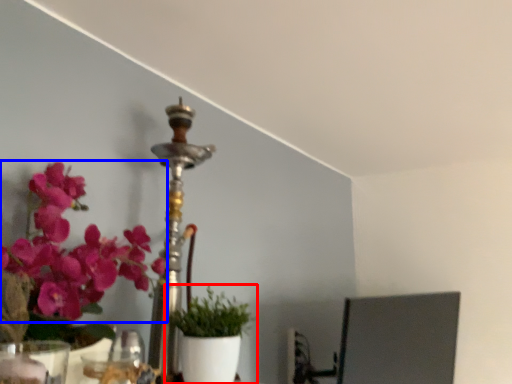
Question: Which object is further to the camera taking this photo, houseplant (highlighted by a red box) or flower (highlighted by a blue box)?

Choices:
 (A) houseplant
 (B) flower

Answer: (A)